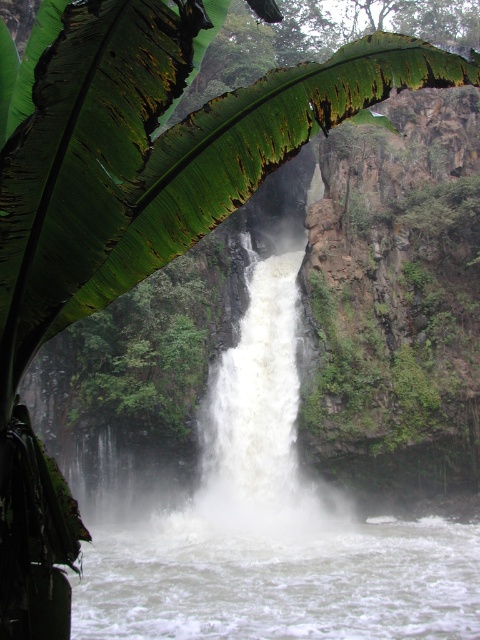
Question: Which object appears closest to the camera in this image?

Choices:
 (A) green leafy banana leaf at upper left
 (B) white frothy water at center

Answer: (A)

Question: Considering the relative positions of green leafy banana leaf at upper left and white frothy water at center in the image provided, where is green leafy banana leaf at upper left located with respect to white frothy water at center?

Choices:
 (A) below
 (B) above

Answer: (B)

Question: Is green leafy banana leaf at upper left closer to camera compared to white frothy water at center?

Choices:
 (A) no
 (B) yes

Answer: (B)

Question: Does green leafy banana leaf at upper left appear over white frothy water at center?

Choices:
 (A) yes
 (B) no

Answer: (A)